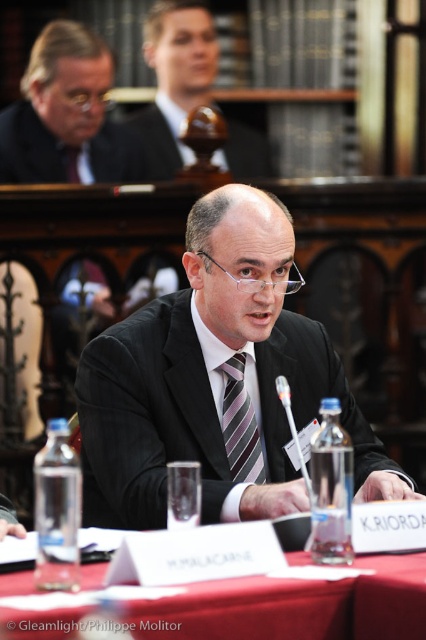
Consider the image. You are attending a formal event and notice two items on the table. Which one is located to the left of the other? The matte black suit at upper left and the striped silk tie at center.

The matte black suit at upper left is positioned on the left side of the striped silk tie at center.

You are a photographer setting up for a formal event. You need to ensure that the black matte suit at center and the striped silk tie at center are both visible in your photo. Based on their positions, which one is closer to the camera?

The black matte suit at center is closer to the camera because it is in front of the striped silk tie at center.